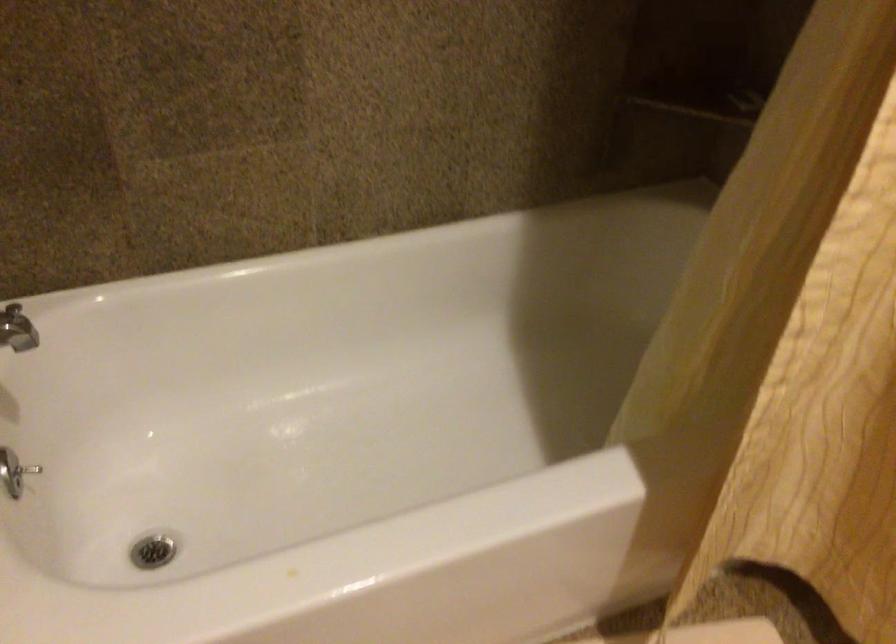
The width and height of the screenshot is (896, 644). Find the location of `shower diverter knob`. shower diverter knob is located at coordinates click(x=21, y=471).